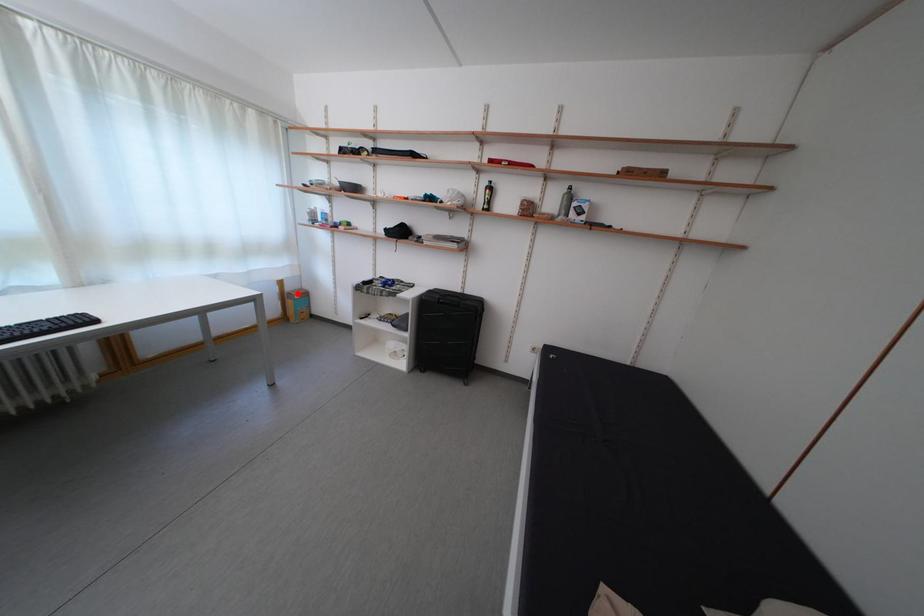
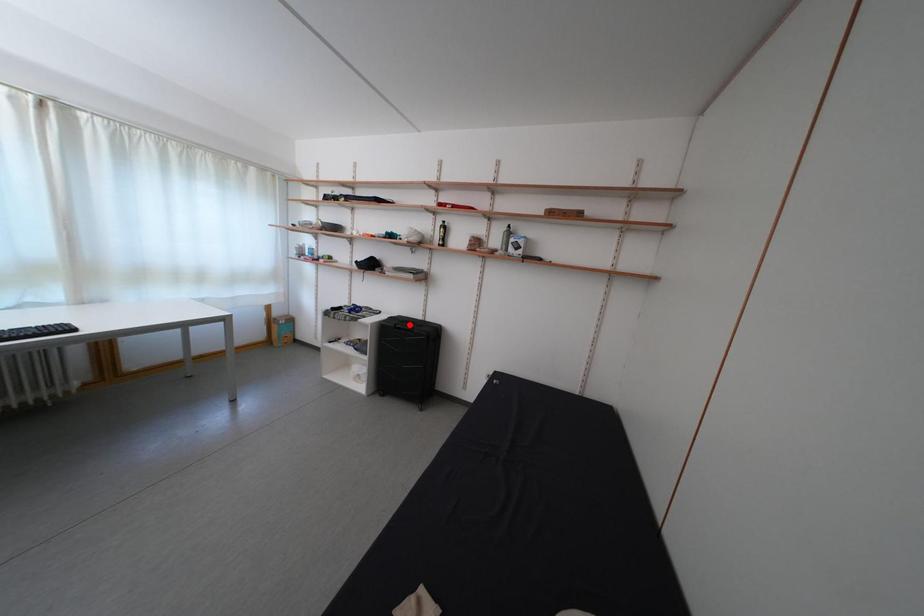
I am providing you with two images of the same scene from different viewpoints. A red point is marked on the first image and another point is marked on the second image. Do the highlighted points in image1 and image2 indicate the same real-world spot?

No